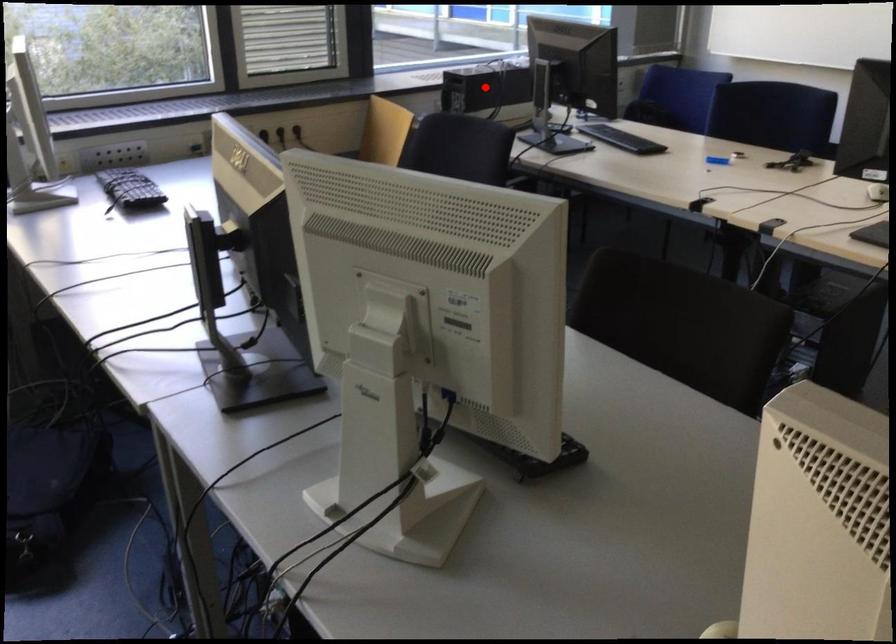
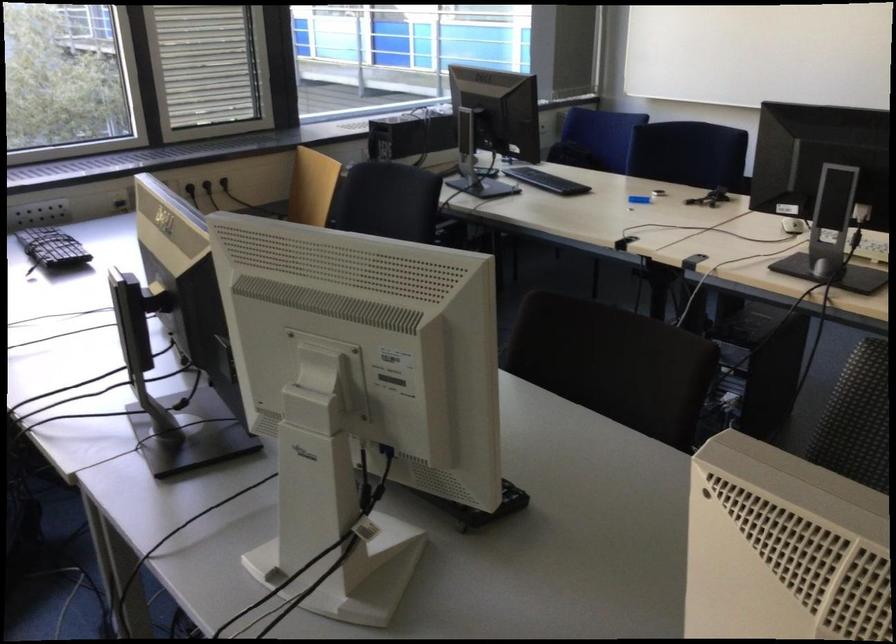
The point at the highlighted location is marked in the first image. Where is the corresponding point in the second image?

(411, 134)